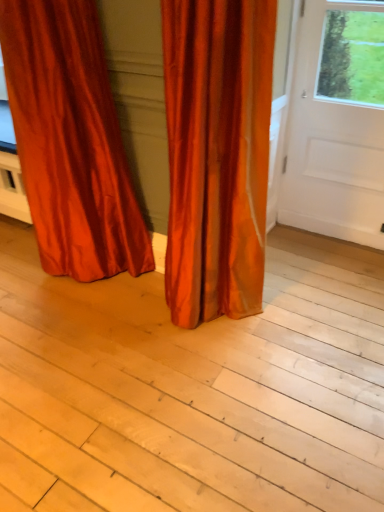
Question: Visually, is light wood plank at center positioned to the left or to the right of satin orange curtain at center, which is the 2th curtain from left to right?

Choices:
 (A) right
 (B) left

Answer: (B)

Question: From the image's perspective, is light wood plank at center located above or below satin orange curtain at center, which is the 2th curtain from left to right?

Choices:
 (A) below
 (B) above

Answer: (A)

Question: Estimate the real-world distances between objects in this image. Which object is farther from the satin orange curtain at lower left, which ranks as the 1th curtain in left-to-right order?

Choices:
 (A) white smooth door at right
 (B) satin orange curtain at center, the first curtain viewed from the right
 (C) light wood plank at center

Answer: (A)

Question: Which object is the closest to the light wood plank at center?

Choices:
 (A) satin orange curtain at lower left, which appears as the 2th curtain when viewed from the right
 (B) satin orange curtain at center, which is the 2th curtain from left to right
 (C) white smooth door at right

Answer: (B)